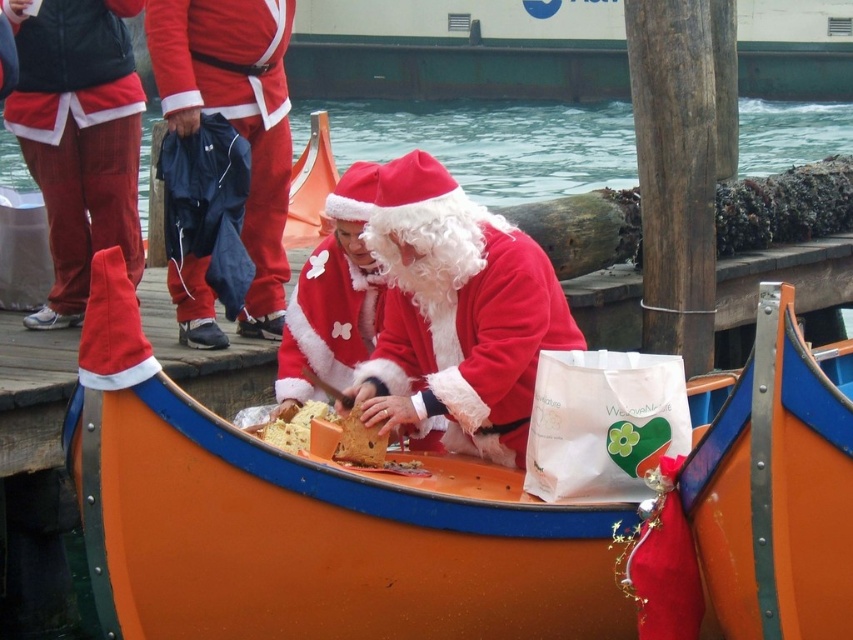
Measure the distance between corduroy santa at center and camera.

A distance of 27.52 meters exists between corduroy santa at center and camera.

Between corduroy santa at center and brown crumbly bread at center, which one appears on the left side from the viewer's perspective?

corduroy santa at center

Between point (62, 228) and point (343, 429), which one is positioned in front?

Point (343, 429)

You are a GUI agent. You are given a task and a screenshot of the screen. Output one action in this format:
    pyautogui.click(x=<x>, y=<y>)
    Task: Click on the corduroy santa at center
    
    Given the screenshot: What is the action you would take?
    pyautogui.click(x=78, y=138)

Looking at this image, does corduroy santa at center have a lesser height compared to crumbly yellow cake at center?

Incorrect, corduroy santa at center's height does not fall short of crumbly yellow cake at center's.

Is corduroy santa at center positioned in front of crumbly yellow cake at center?

No, it is not.

Does point (134, 116) come closer to viewer compared to point (274, 428)?

That is False.

The height and width of the screenshot is (640, 853). I want to click on corduroy santa at center, so click(x=78, y=138).

Does point (403, 292) lie in front of point (379, 436)?

No, (403, 292) is behind (379, 436).

Does fuzzy red santa at center have a lesser height compared to brown crumbly bread at center?

In fact, fuzzy red santa at center may be taller than brown crumbly bread at center.

Describe the element at coordinates (456, 314) in the screenshot. I see `fuzzy red santa at center` at that location.

You are a GUI agent. You are given a task and a screenshot of the screen. Output one action in this format:
    pyautogui.click(x=<x>, y=<y>)
    Task: Click on the fuzzy red santa at center
    
    Given the screenshot: What is the action you would take?
    pyautogui.click(x=456, y=314)